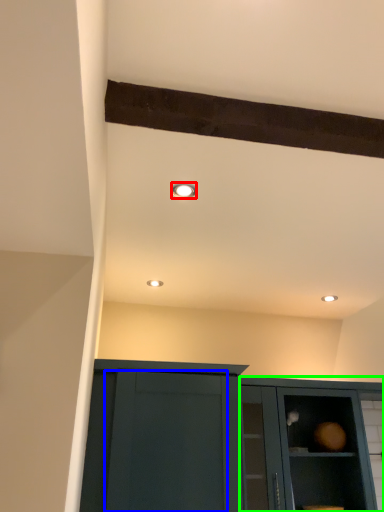
Question: Based on their relative distances, which object is farther from lighting (highlighted by a red box)? Choose from glass door (highlighted by a blue box) and cabinetry (highlighted by a green box).

Choices:
 (A) glass door
 (B) cabinetry

Answer: (B)